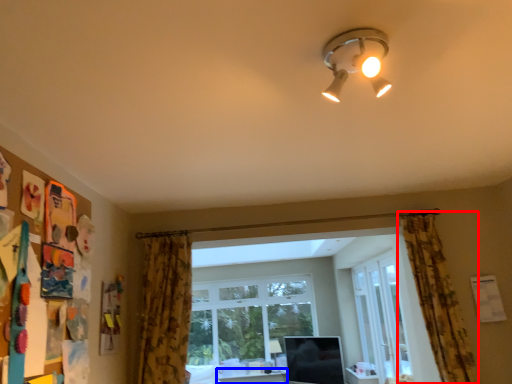
Question: Which of the following is the farthest to the observer, curtain (highlighted by a red box) or table (highlighted by a blue box)?

Choices:
 (A) curtain
 (B) table

Answer: (B)